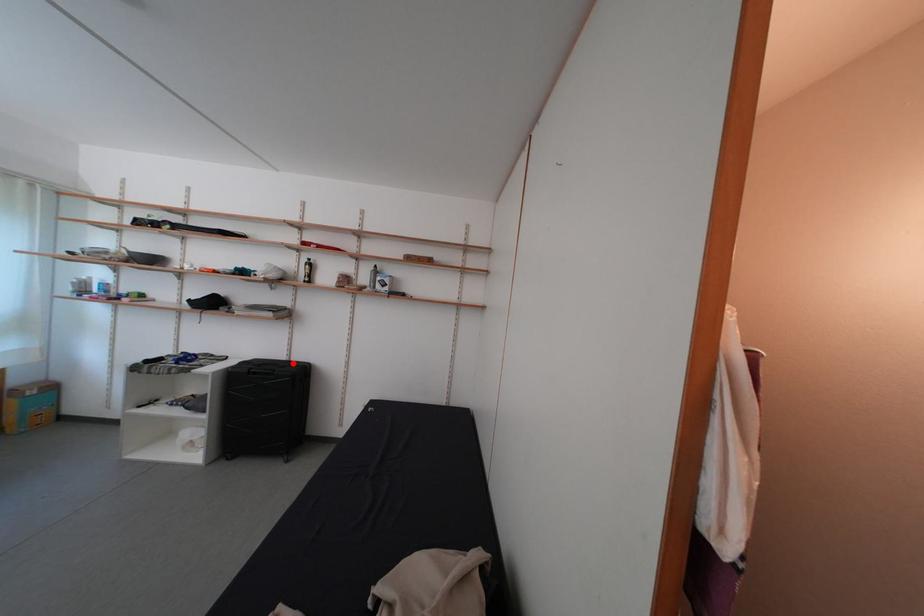
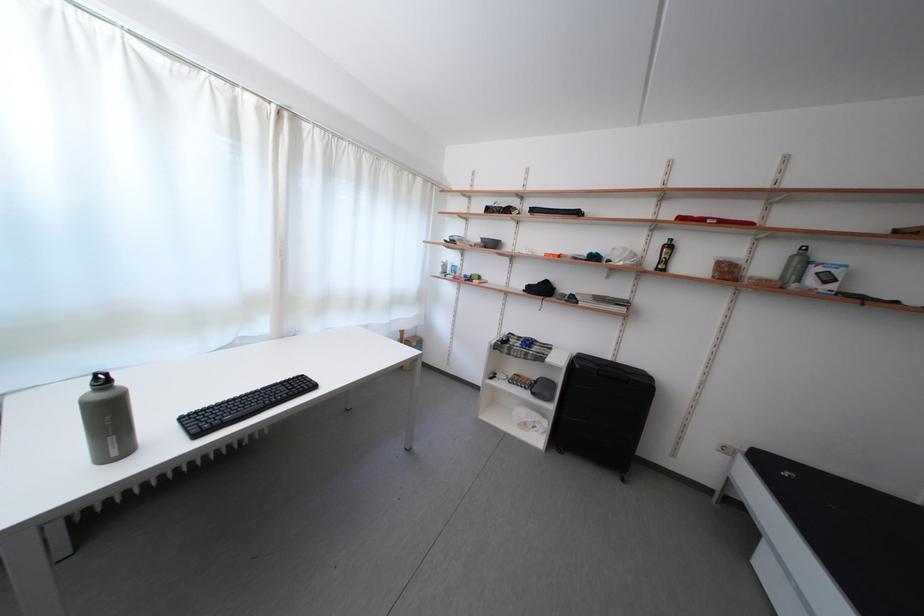
Question: I am providing you with two images of the same scene from different viewpoints. Image1 has a red point marked. In image2, the corresponding 3D location appears at what relative position? Reply with the corresponding letter.

Choices:
 (A) Closer
 (B) Farther

Answer: (A)